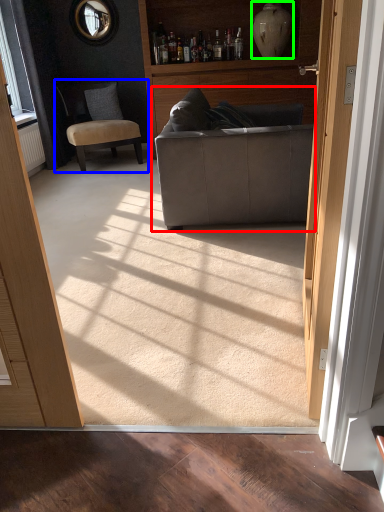
Question: Based on their relative distances, which object is farther from studio couch (highlighted by a red box)? Choose from chair (highlighted by a blue box) and vase (highlighted by a green box).

Choices:
 (A) chair
 (B) vase

Answer: (A)